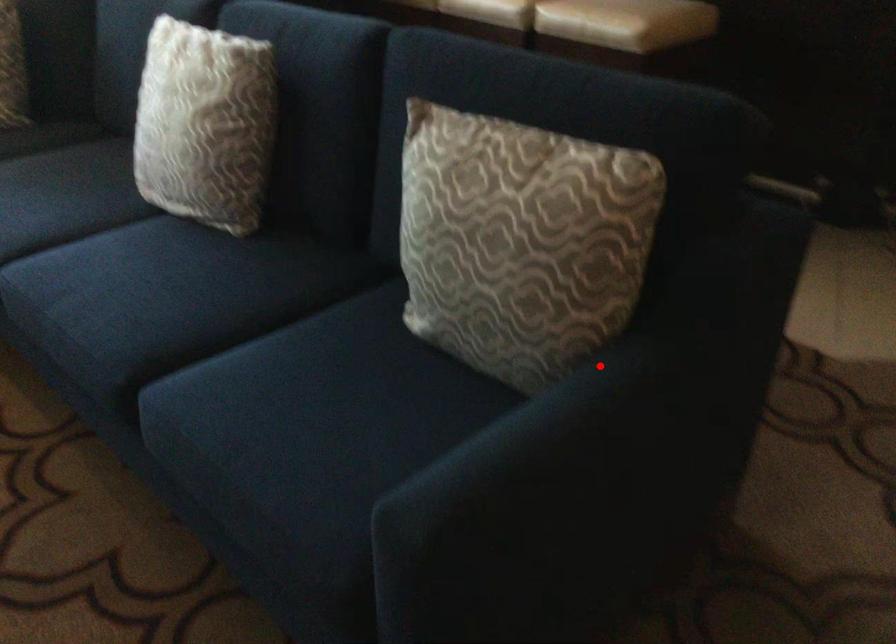
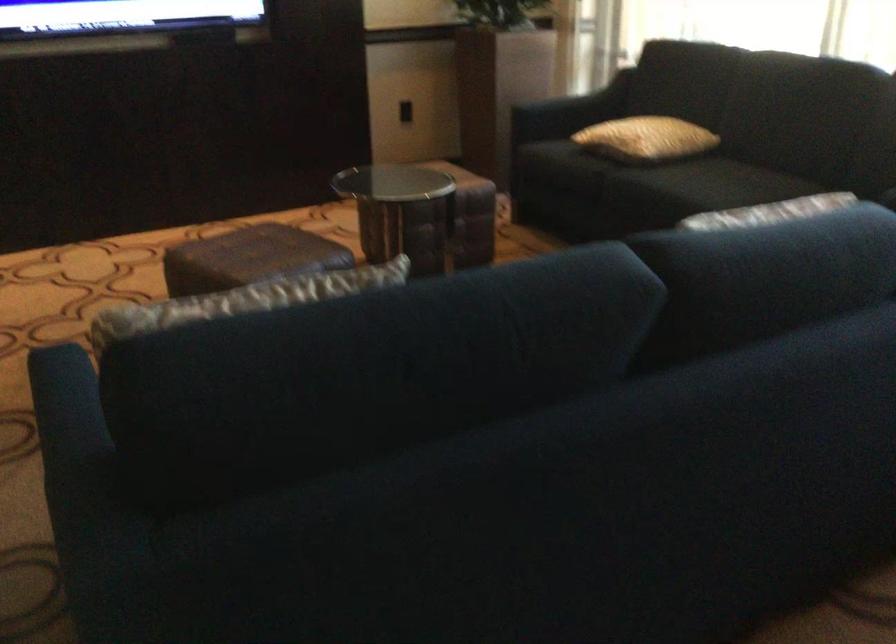
Question: I am providing you with two images of the same scene from different viewpoints. Given a red point in image1, look at the same physical point in image2. Is it:

Choices:
 (A) Closer to the viewpoint
 (B) Farther from the viewpoint

Answer: (B)